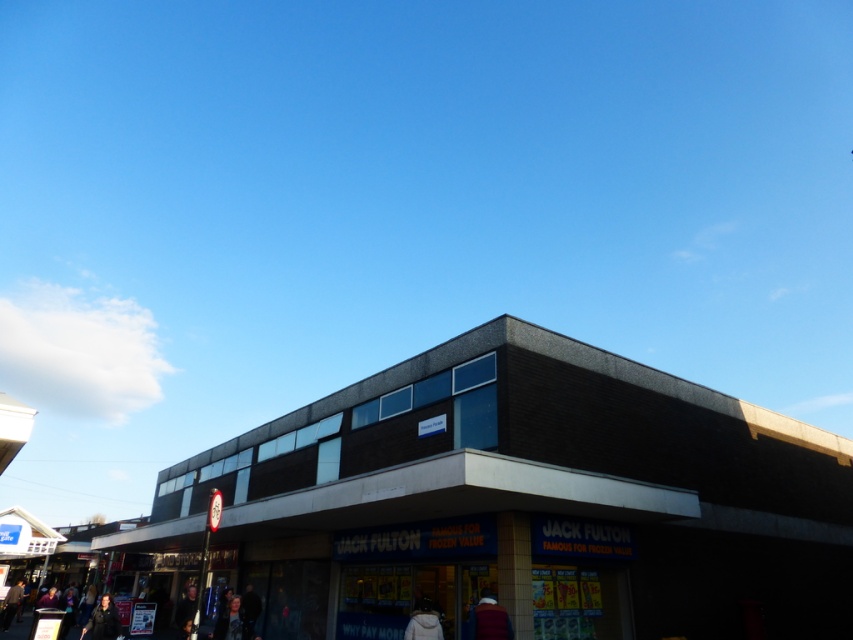
You are a delivery person standing in front of the dark gray concrete jack fulton store at center and the white fabric jacket at lower center. Which object is positioned to the right side?

The white fabric jacket at lower center is positioned to the right of the dark gray concrete jack fulton store at center.